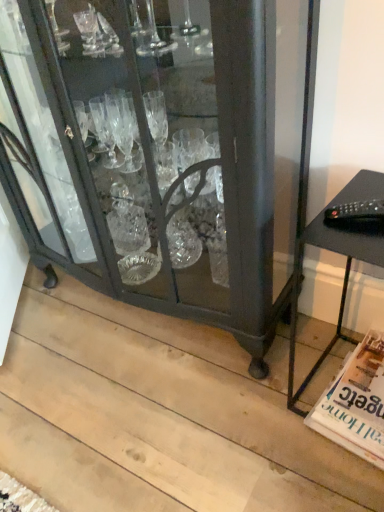
Question: Can you confirm if white glossy magazine at lower right is positioned to the right of matte black cabinet at center?

Choices:
 (A) yes
 (B) no

Answer: (A)

Question: Is white glossy magazine at lower right positioned in front of matte black cabinet at center?

Choices:
 (A) yes
 (B) no

Answer: (B)

Question: Can you confirm if white glossy magazine at lower right is wider than matte black cabinet at center?

Choices:
 (A) no
 (B) yes

Answer: (B)

Question: Is white glossy magazine at lower right far away from matte black cabinet at center?

Choices:
 (A) yes
 (B) no

Answer: (B)

Question: Considering the relative sizes of white glossy magazine at lower right and matte black cabinet at center in the image provided, is white glossy magazine at lower right shorter than matte black cabinet at center?

Choices:
 (A) no
 (B) yes

Answer: (B)

Question: Is matte black cabinet at center located within white glossy magazine at lower right?

Choices:
 (A) no
 (B) yes

Answer: (A)

Question: Is white glossy magazine at lower right oriented away from black matte table at right?

Choices:
 (A) no
 (B) yes

Answer: (B)

Question: Is white glossy magazine at lower right far from black matte table at right?

Choices:
 (A) no
 (B) yes

Answer: (A)

Question: Is white glossy magazine at lower right not inside black matte table at right?

Choices:
 (A) no
 (B) yes

Answer: (A)

Question: Can you confirm if white glossy magazine at lower right is positioned to the left of black matte table at right?

Choices:
 (A) yes
 (B) no

Answer: (B)

Question: Is white glossy magazine at lower right further to camera compared to black matte table at right?

Choices:
 (A) yes
 (B) no

Answer: (A)

Question: From a real-world perspective, does white glossy magazine at lower right stand above black matte table at right?

Choices:
 (A) yes
 (B) no

Answer: (B)

Question: Is black matte table at right at the right side of white glossy magazine at lower right?

Choices:
 (A) no
 (B) yes

Answer: (A)